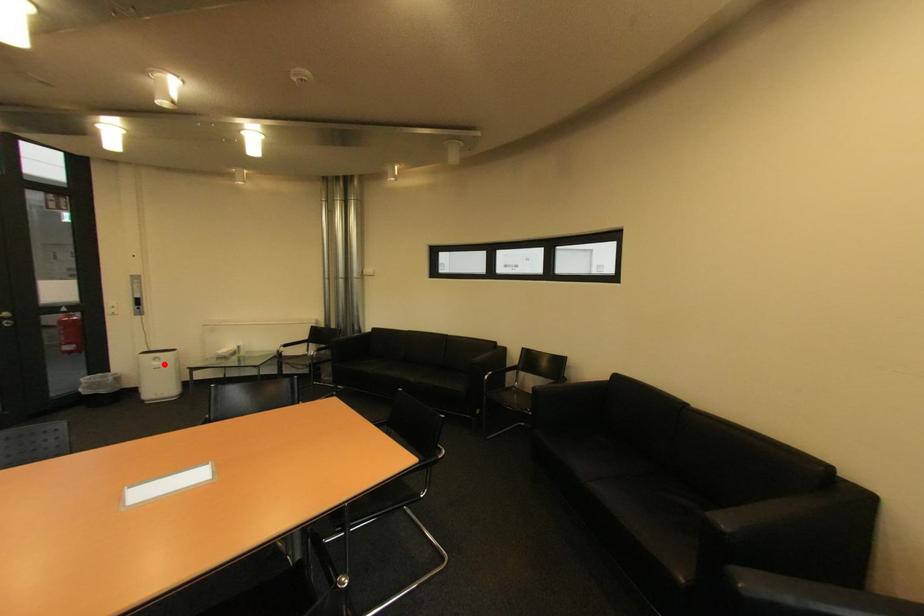
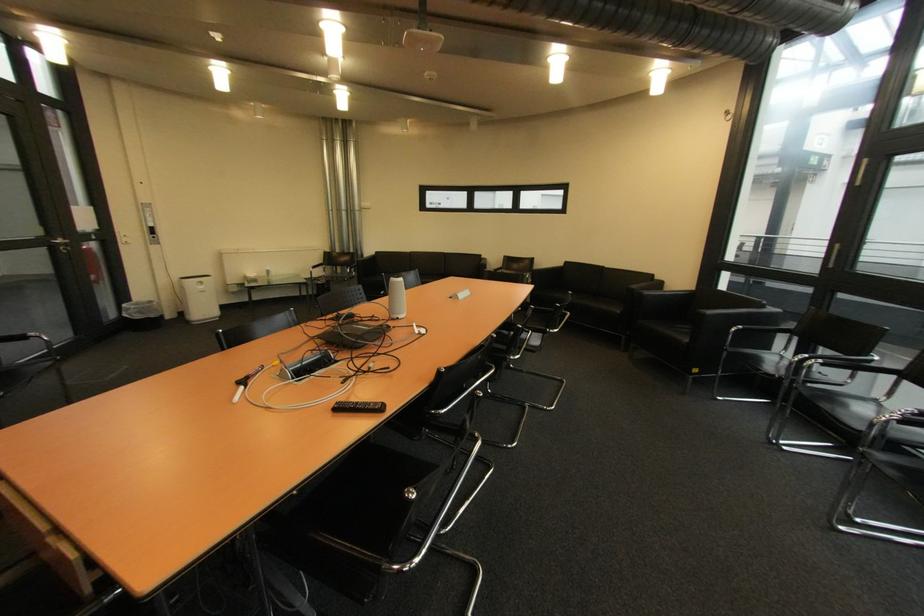
The point at the highlighted location is marked in the first image. Where is the corresponding point in the second image?

(209, 288)